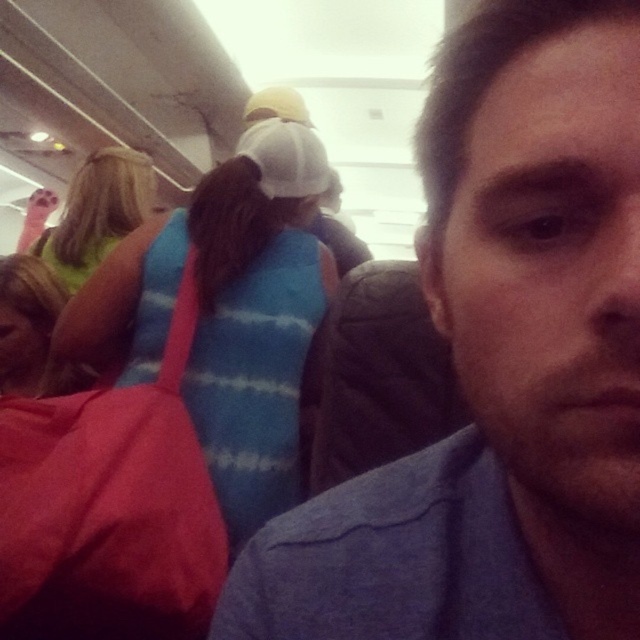
Question: Can you confirm if blue cotton shirt at center is positioned to the left of blue striped sweater at upper center?

Choices:
 (A) yes
 (B) no

Answer: (B)

Question: Does blue cotton shirt at center have a lesser width compared to blue striped sweater at upper center?

Choices:
 (A) yes
 (B) no

Answer: (A)

Question: Is blue cotton shirt at center positioned in front of blue striped sweater at upper center?

Choices:
 (A) yes
 (B) no

Answer: (A)